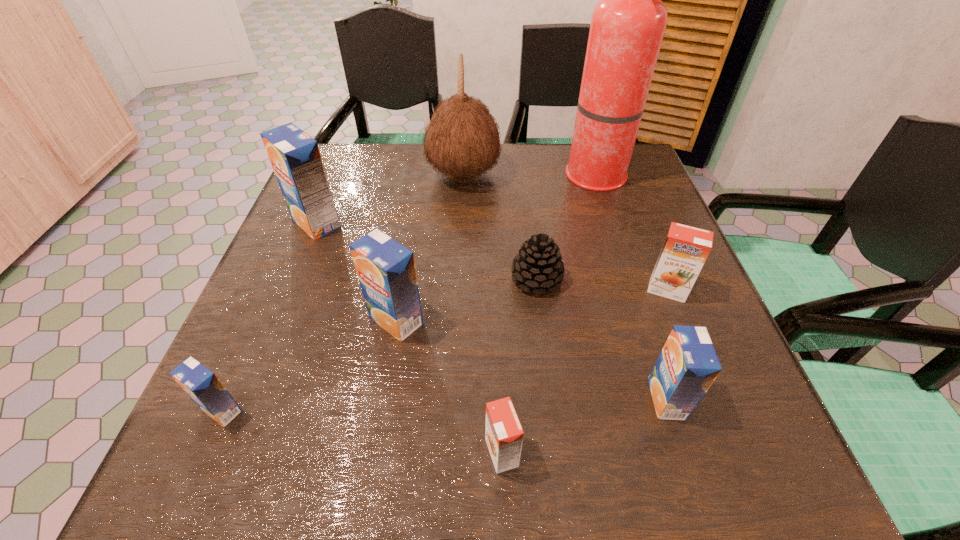
The image size is (960, 540). I want to click on the rightmost blue orange_juice, so click(x=687, y=366).

You are a GUI agent. You are given a task and a screenshot of the screen. Output one action in this format:
    pyautogui.click(x=<x>, y=<y>)
    Task: Click on the pinecone
    This screenshot has height=540, width=960.
    Given the screenshot: What is the action you would take?
    tap(538, 265)

Image resolution: width=960 pixels, height=540 pixels. I want to click on the smallest blue orange_juice, so click(201, 384).

Find the location of `the nearer orange orange juice`. the nearer orange orange juice is located at coordinates (504, 435).

The height and width of the screenshot is (540, 960). In order to click on the nearest orange juice in this screenshot , I will do `click(504, 435)`.

I want to click on vacant region located with the handle and hose on the fire extinguisher, so click(x=412, y=179).

Locate an element on the screen. This screenshot has width=960, height=540. vacant space located with the handle and hose on the fire extinguisher is located at coordinates (536, 179).

Locate an element on the screen. Image resolution: width=960 pixels, height=540 pixels. free space located 0.230m with the handle and hose on the fire extinguisher is located at coordinates point(478,179).

You are a GUI agent. You are given a task and a screenshot of the screen. Output one action in this format:
    pyautogui.click(x=<x>, y=<y>)
    Task: Click on the free region located on the surface of the coconut
    The width and height of the screenshot is (960, 540).
    Given the screenshot: What is the action you would take?
    click(537, 176)

This screenshot has height=540, width=960. In order to click on free spot located on the front of the biggest blue orange_juice in this screenshot , I will do `click(290, 287)`.